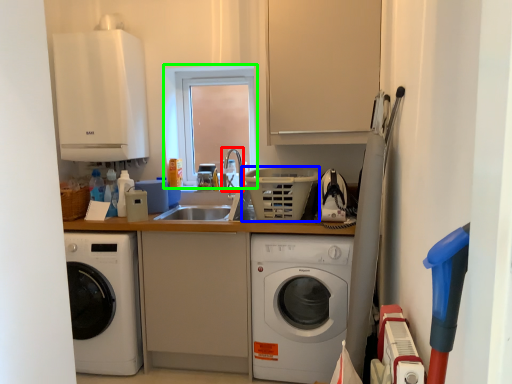
Question: Which object is positioned farthest from faucet (highlighted by a red box)? Select from basket (highlighted by a blue box) and window (highlighted by a green box).

Choices:
 (A) basket
 (B) window

Answer: (A)